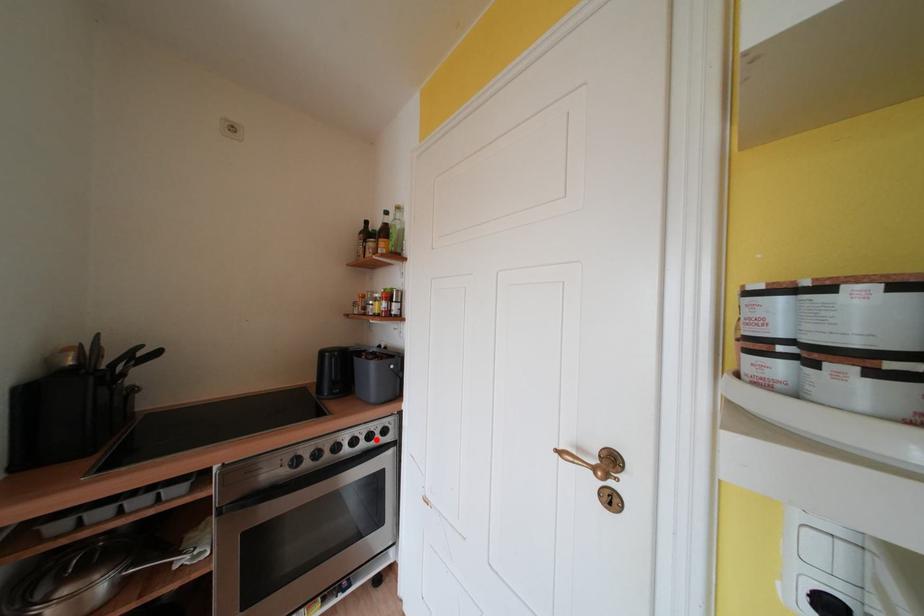
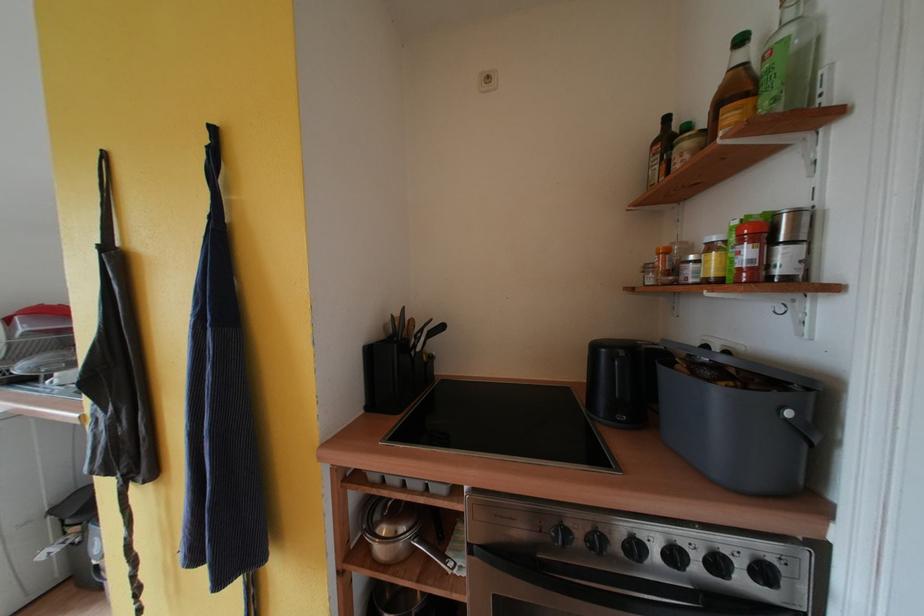
Find the pixel in the second image that matches the highlighted location in the first image.

(723, 567)